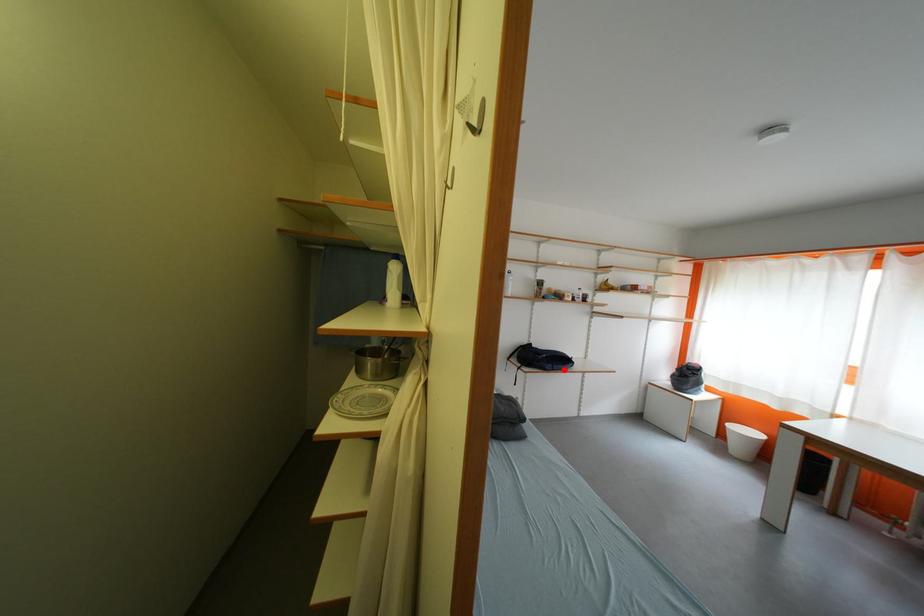
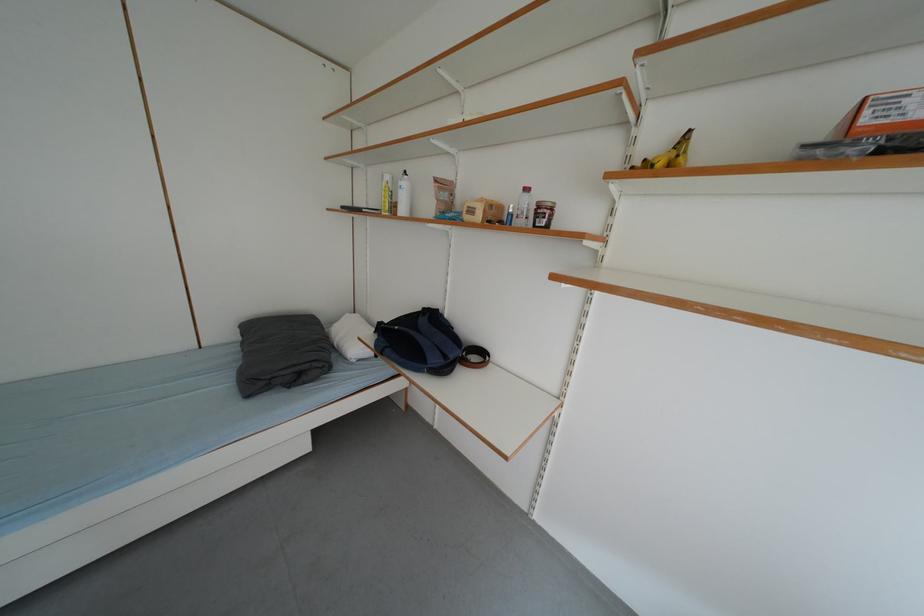
In the second image, find the point that corresponds to the highlighted location in the first image.

(396, 354)